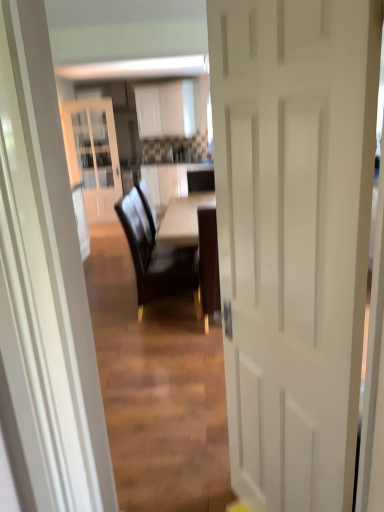
Question: Considering their positions, is dark brown leather chair at center located in front of or behind white matte door at center?

Choices:
 (A) front
 (B) behind

Answer: (B)

Question: From a real-world perspective, is dark brown leather chair at center positioned above or below white matte door at center?

Choices:
 (A) above
 (B) below

Answer: (B)

Question: Which is correct: dark brown leather chair at center is inside white matte door at center, or outside of it?

Choices:
 (A) outside
 (B) inside

Answer: (A)

Question: Is point (311, 327) positioned closer to the camera than point (142, 251)?

Choices:
 (A) farther
 (B) closer

Answer: (B)

Question: From their relative heights in the image, would you say white matte door at center is taller or shorter than dark brown leather chair at center?

Choices:
 (A) short
 (B) tall

Answer: (B)

Question: Choose the correct answer: Is white matte door at center inside dark brown leather chair at center or outside it?

Choices:
 (A) inside
 (B) outside

Answer: (B)

Question: Is white matte door at center in front of or behind dark brown leather chair at center in the image?

Choices:
 (A) front
 (B) behind

Answer: (A)